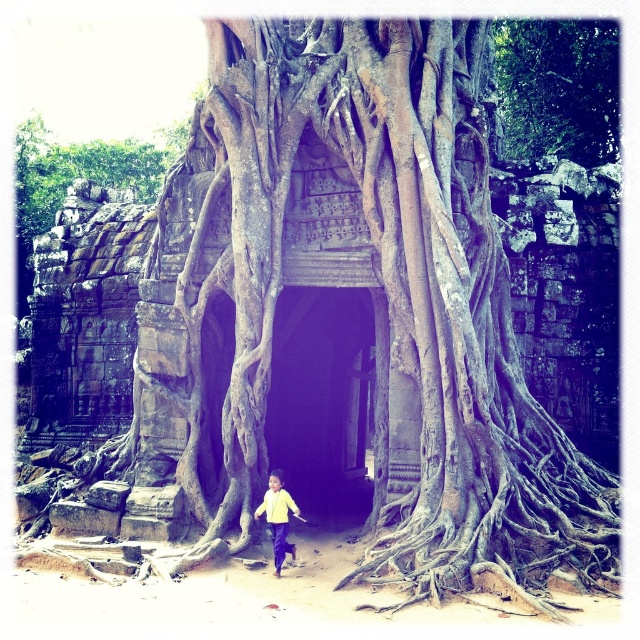
Between brown rough textured banyan tree at center and dark stone archway at center, which one appears on the right side from the viewer's perspective?

From the viewer's perspective, brown rough textured banyan tree at center appears more on the right side.

What are the coordinates of `brown rough textured banyan tree at center` in the screenshot? It's located at (380, 298).

Is brown rough tree roots at center bigger than yellow matte shirt at center?

Yes.

Does brown rough tree roots at center have a smaller size compared to yellow matte shirt at center?

No, brown rough tree roots at center is not smaller than yellow matte shirt at center.

Is point (68, 147) positioned after point (266, 518)?

Yes, point (68, 147) is behind point (266, 518).

At what (x,y) coordinates should I click in order to perform the action: click on brown rough tree roots at center. Please return your answer as a coordinate pair (x, y). This screenshot has width=640, height=640. Looking at the image, I should click on (77, 172).

Is point (509, 147) closer to viewer compared to point (51, 172)?

Yes.

Can you confirm if green leafy tree at upper center is smaller than brown rough tree roots at center?

Yes, green leafy tree at upper center is smaller than brown rough tree roots at center.

This screenshot has width=640, height=640. In order to click on green leafy tree at upper center in this screenshot , I will do `click(557, 88)`.